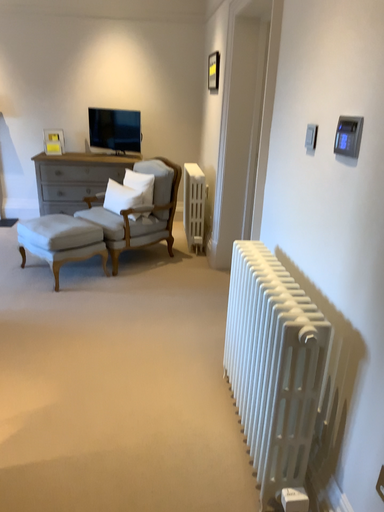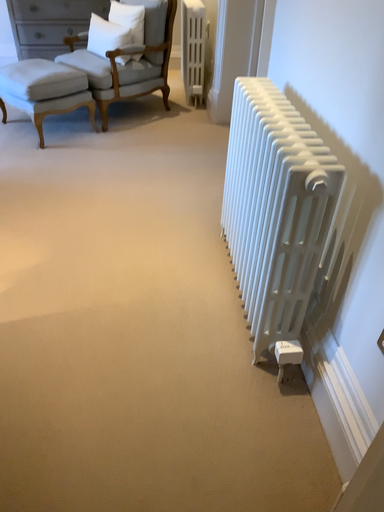
Question: Which way did the camera rotate in the video?

Choices:
 (A) rotated downward
 (B) rotated upward

Answer: (A)